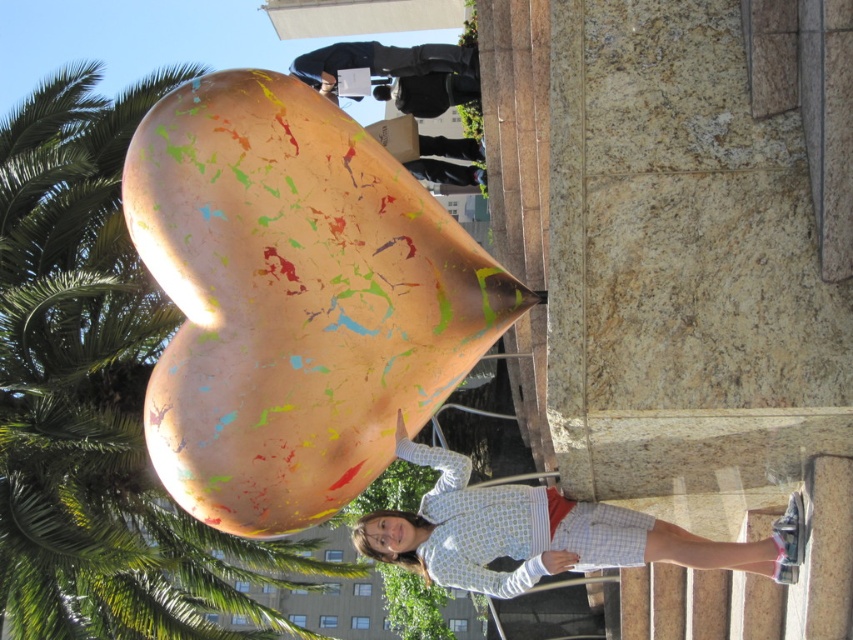
You are a photographer trying to capture a clear shot of the light blue striped shirt at center while also including the green leafy palm tree at upper left in the frame. Which object should you adjust your camera angle to focus on first to ensure both are visible?

The green leafy palm tree at upper left is closer to the viewer than the light blue striped shirt at center, so you should focus on the green leafy palm tree at upper left first to ensure it doesn not block the light blue striped shirt at center.